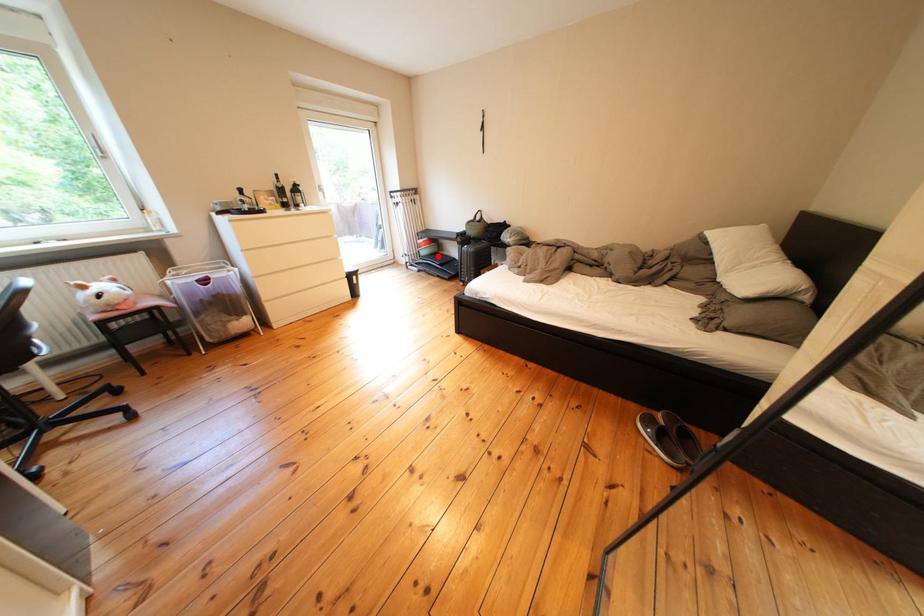
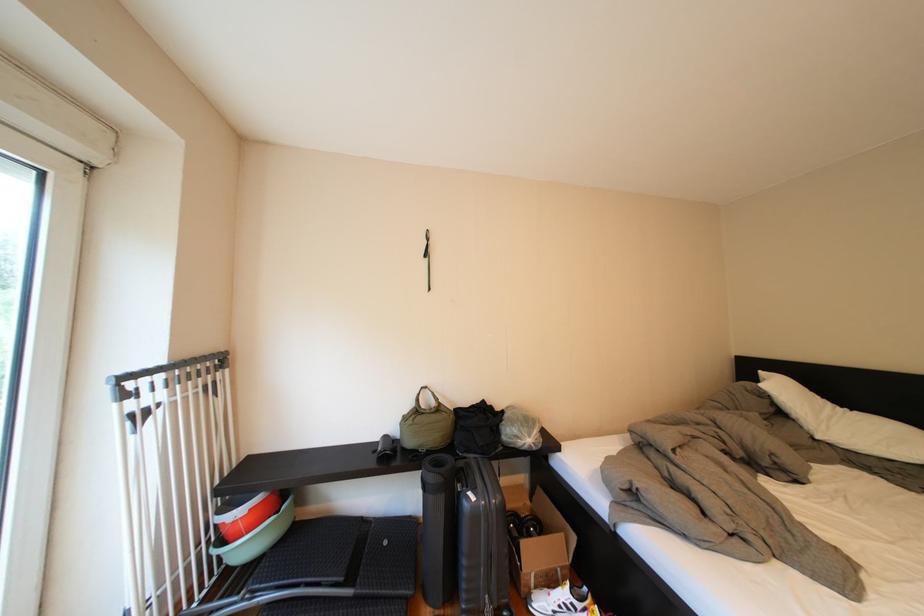
Question: A red point is marked in image1. In image2, is the corresponding 3D point closer to the camera or farther? Reply with the corresponding letter.

Choices:
 (A) The corresponding 3D point is closer.
 (B) The corresponding 3D point is farther.

Answer: (B)